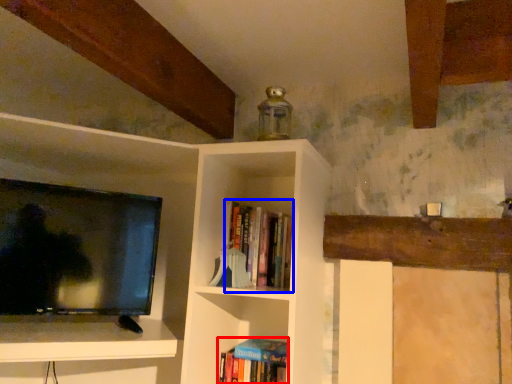
Question: Which object appears closest to the camera in this image, book (highlighted by a red box) or book (highlighted by a blue box)?

Choices:
 (A) book
 (B) book

Answer: (B)